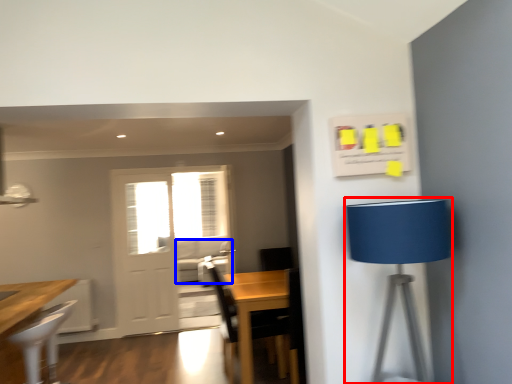
Question: Among these objects, which one is nearest to the camera, table lamp (highlighted by a red box) or couch (highlighted by a blue box)?

Choices:
 (A) table lamp
 (B) couch

Answer: (A)